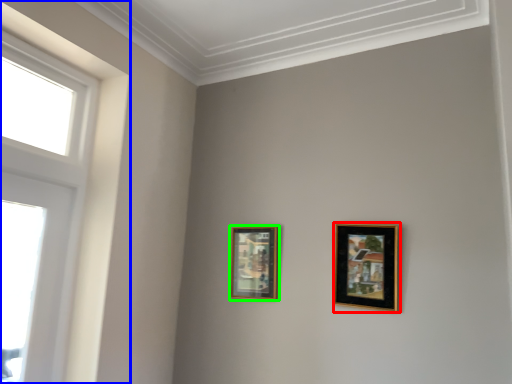
Question: Estimate the real-world distances between objects in this image. Which object is farther from picture frame (highlighted by a red box), window (highlighted by a blue box) or picture frame (highlighted by a green box)?

Choices:
 (A) window
 (B) picture frame

Answer: (A)